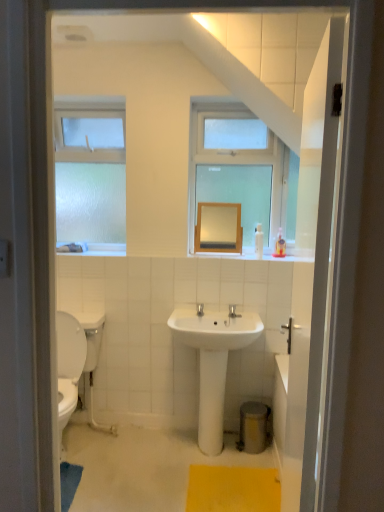
Locate an element on the screen. The image size is (384, 512). free spot above yellow textured bath mat at lower center (from a real-world perspective) is located at coordinates (225, 487).